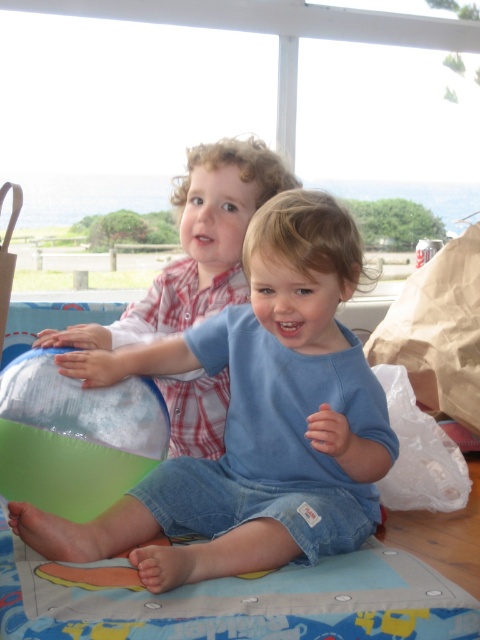
Question: Does blue denim shorts at center have a lesser width compared to green rubber ball at lower left?

Choices:
 (A) yes
 (B) no

Answer: (B)

Question: Which of these objects is positioned farthest from the blue cotton shirt at center?

Choices:
 (A) blue denim shorts at center
 (B) green rubber ball at lower left

Answer: (A)

Question: Which of the following is the farthest from the observer?

Choices:
 (A) blue denim shorts at center
 (B) green rubber ball at lower left

Answer: (B)

Question: Does blue denim shorts at center appear under green rubber ball at lower left?

Choices:
 (A) yes
 (B) no

Answer: (B)

Question: Observing the image, what is the correct spatial positioning of blue denim shorts at center in reference to green rubber ball at lower left?

Choices:
 (A) right
 (B) left

Answer: (A)

Question: Estimate the real-world distances between objects in this image. Which object is farther from the green rubber ball at lower left?

Choices:
 (A) blue denim shorts at center
 (B) blue cotton shirt at center

Answer: (B)